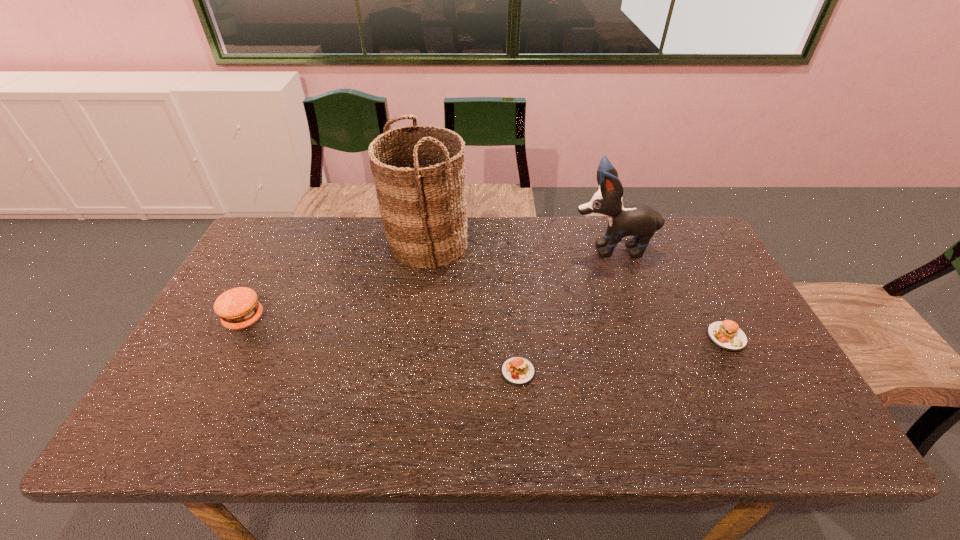
What are the coordinates of `vacant space that satisfies the following two spatial constraints: 1. on the front side of the third object from left to right; 2. on the left side of the tallest object` in the screenshot? It's located at (409, 372).

Find the location of `vacant space that satisfies the following two spatial constraints: 1. on the back side of the second shortest patty (food); 2. on the front-facing side of the puppy`. vacant space that satisfies the following two spatial constraints: 1. on the back side of the second shortest patty (food); 2. on the front-facing side of the puppy is located at coordinates (681, 248).